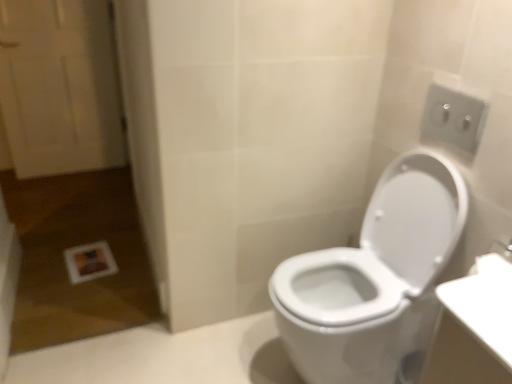
Question: Does white glossy toilet at right have a lesser height compared to white plastic outlet at upper right?

Choices:
 (A) yes
 (B) no

Answer: (B)

Question: Does white glossy toilet at right appear on the left side of white plastic outlet at upper right?

Choices:
 (A) yes
 (B) no

Answer: (A)

Question: Is the position of white glossy toilet at right less distant than that of white plastic outlet at upper right?

Choices:
 (A) no
 (B) yes

Answer: (B)

Question: Can you confirm if white glossy toilet at right is positioned to the right of white plastic outlet at upper right?

Choices:
 (A) no
 (B) yes

Answer: (A)

Question: Considering the relative sizes of white glossy toilet at right and white plastic outlet at upper right in the image provided, is white glossy toilet at right smaller than white plastic outlet at upper right?

Choices:
 (A) yes
 (B) no

Answer: (B)

Question: From a real-world perspective, is white glossy toilet at right on top of white plastic outlet at upper right?

Choices:
 (A) no
 (B) yes

Answer: (A)

Question: Considering the relative sizes of white glossy toilet at right and white wooden door at left in the image provided, is white glossy toilet at right taller than white wooden door at left?

Choices:
 (A) yes
 (B) no

Answer: (B)

Question: Would you consider white glossy toilet at right to be distant from white wooden door at left?

Choices:
 (A) no
 (B) yes

Answer: (B)

Question: Does white glossy toilet at right come in front of white wooden door at left?

Choices:
 (A) no
 (B) yes

Answer: (B)

Question: Are white glossy toilet at right and white wooden door at left beside each other?

Choices:
 (A) yes
 (B) no

Answer: (B)

Question: From the image's perspective, is white glossy toilet at right located above white wooden door at left?

Choices:
 (A) no
 (B) yes

Answer: (A)

Question: Considering the relative sizes of white glossy toilet at right and white wooden door at left in the image provided, is white glossy toilet at right thinner than white wooden door at left?

Choices:
 (A) no
 (B) yes

Answer: (A)

Question: Is white plastic outlet at upper right to the right of white glossy toilet at right from the viewer's perspective?

Choices:
 (A) yes
 (B) no

Answer: (A)